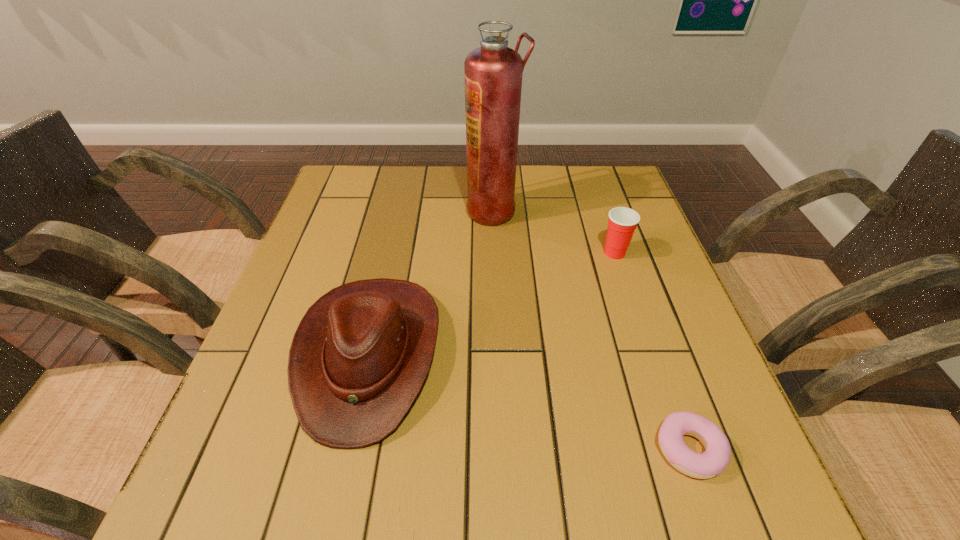
Locate an element on the screen. The width and height of the screenshot is (960, 540). blank space at the right edge is located at coordinates (629, 312).

Find the location of `vacant area at the far left corner of the desktop`. vacant area at the far left corner of the desktop is located at coordinates (351, 203).

Locate an element on the screen. The image size is (960, 540). vacant space at the near right corner of the desktop is located at coordinates (694, 510).

Find the location of a particular element. vacant point located between the second farthest object and the leftmost object is located at coordinates (492, 303).

You are a GUI agent. You are given a task and a screenshot of the screen. Output one action in this format:
    pyautogui.click(x=<x>, y=<y>)
    Task: Click on the vacant space that's between the leftmost object and the farthest object
    This screenshot has width=960, height=540.
    Given the screenshot: What is the action you would take?
    431,282

Find the location of `free spot between the leftmost object and the shortest object`. free spot between the leftmost object and the shortest object is located at coordinates (529, 402).

The width and height of the screenshot is (960, 540). What are the coordinates of `blank region between the third nearest object and the second object from left to right` in the screenshot? It's located at (554, 232).

Identify the location of free space that is in between the pastry and the fire extinguisher. This screenshot has width=960, height=540. (591, 330).

The height and width of the screenshot is (540, 960). In order to click on free space between the second farthest object and the third object from right to left in this screenshot , I will do `click(554, 232)`.

Find the location of `empty space between the second farthest object and the shortest object`. empty space between the second farthest object and the shortest object is located at coordinates (652, 351).